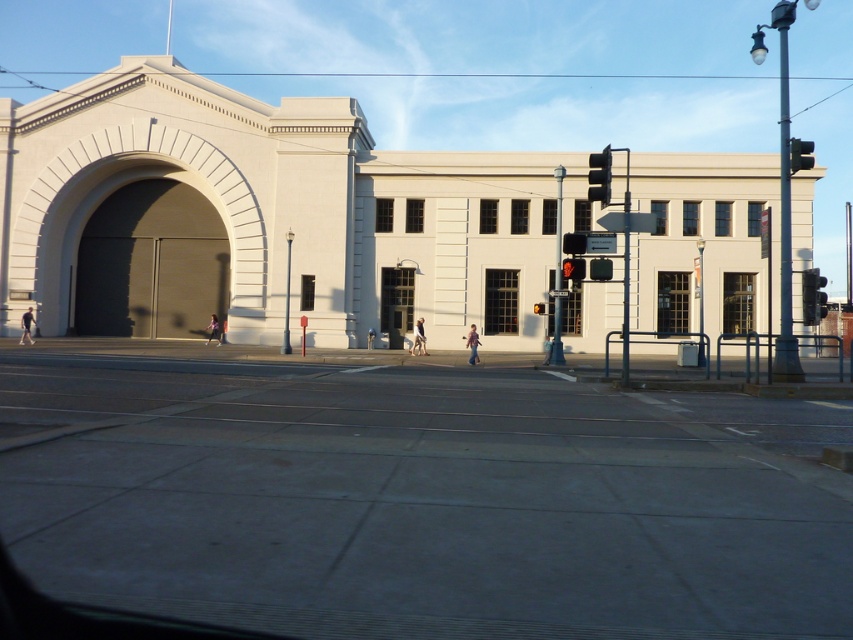
You are a pedestrian standing on the sidewalk near the tram tracks. You see a point marked at coordinates (599,177). What object is located at that point?

The point at coordinates (599,177) indicates the black plastic traffic light at upper right.

You are a pedestrian waiting at the crosswalk near the large white building. You notice two traffic lights at the upper right corner of your view. Which one is positioned lower between the black plastic traffic light at upper right and the metallic traffic light at upper right?

The black plastic traffic light at upper right is positioned lower because it is located below the metallic traffic light at upper right.